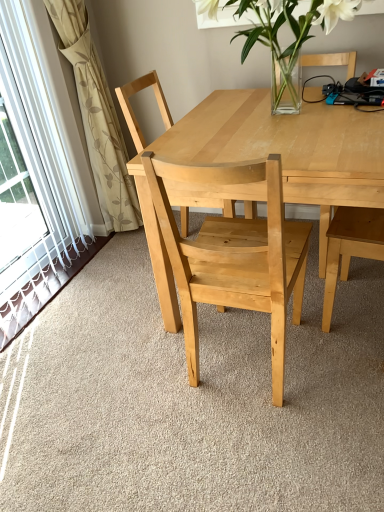
Find the location of a particular element. The height and width of the screenshot is (512, 384). vacant area situated to the left side of natural wood chair at center, the 1th chair viewed from the front is located at coordinates (135, 392).